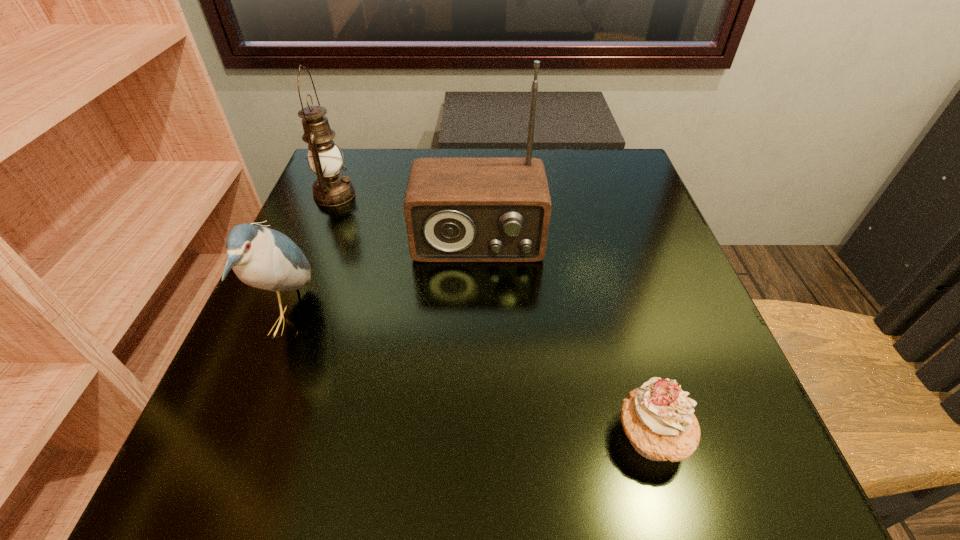
I want to click on the third nearest object, so (x=456, y=209).

Find the location of a particular element. Image resolution: width=960 pixels, height=540 pixels. radio receiver is located at coordinates (456, 209).

Identify the location of the second tallest object. The height and width of the screenshot is (540, 960). (331, 188).

Locate an element on the screen. the farthest object is located at coordinates (331, 188).

Image resolution: width=960 pixels, height=540 pixels. Find the location of `the second nearest object`. the second nearest object is located at coordinates (261, 257).

You are a GUI agent. You are given a task and a screenshot of the screen. Output one action in this format:
    pyautogui.click(x=<x>, y=<y>)
    Task: Click on the third tallest object
    The width and height of the screenshot is (960, 540).
    Given the screenshot: What is the action you would take?
    pyautogui.click(x=261, y=257)

You are a GUI agent. You are given a task and a screenshot of the screen. Output one action in this format:
    pyautogui.click(x=<x>, y=<y>)
    Task: Click on the rightmost object
    The height and width of the screenshot is (540, 960).
    Given the screenshot: What is the action you would take?
    pyautogui.click(x=658, y=419)

At what (x,y) coordinates should I click in order to perform the action: click on the nearest object. Please return your answer as a coordinate pair (x, y). The height and width of the screenshot is (540, 960). Looking at the image, I should click on (x=658, y=419).

Image resolution: width=960 pixels, height=540 pixels. I want to click on free space located 0.280m on the front-facing side of the radio receiver, so click(x=477, y=399).

Where is `vacant space located on the front of the second tallest object`? vacant space located on the front of the second tallest object is located at coordinates (292, 300).